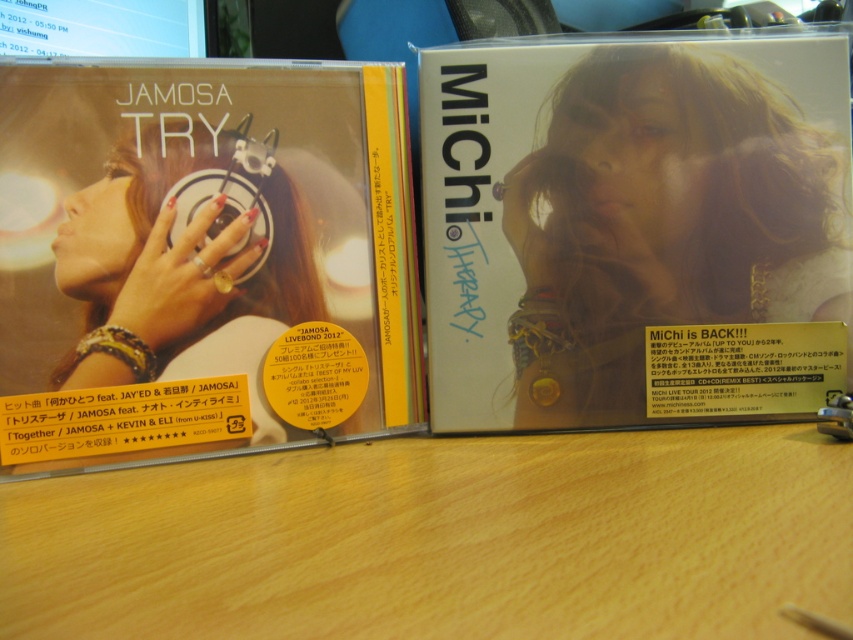
Question: Which object appears closest to the camera in this image?

Choices:
 (A) matte white cd at center
 (B) wooden table at center

Answer: (B)

Question: Can you confirm if matte black cd at left is positioned above matte white cd at center?

Choices:
 (A) no
 (B) yes

Answer: (A)

Question: Which object is the farthest from the wooden table at center?

Choices:
 (A) matte white cd at center
 (B) matte black cd at left

Answer: (A)

Question: From the image, what is the correct spatial relationship of matte black cd at left in relation to matte white cd at center?

Choices:
 (A) above
 (B) below

Answer: (B)

Question: Estimate the real-world distances between objects in this image. Which object is farther from the matte black cd at left?

Choices:
 (A) wooden table at center
 (B) matte white cd at center

Answer: (A)

Question: Does matte white cd at center have a smaller size compared to wooden table at center?

Choices:
 (A) yes
 (B) no

Answer: (A)